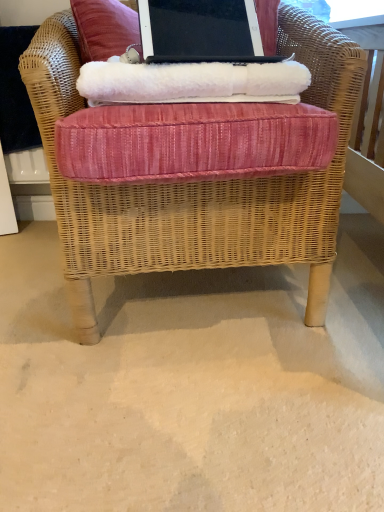
Question: Is white fluffy blanket at upper center far from woven wicker chair at center?

Choices:
 (A) no
 (B) yes

Answer: (A)

Question: From the image's perspective, does white fluffy blanket at upper center appear lower than woven wicker chair at center?

Choices:
 (A) no
 (B) yes

Answer: (A)

Question: Does white fluffy blanket at upper center turn towards woven wicker chair at center?

Choices:
 (A) no
 (B) yes

Answer: (B)

Question: Considering the relative positions of white fluffy blanket at upper center and woven wicker chair at center in the image provided, is white fluffy blanket at upper center to the left of woven wicker chair at center from the viewer's perspective?

Choices:
 (A) yes
 (B) no

Answer: (B)

Question: Does white fluffy blanket at upper center appear on the right side of woven wicker chair at center?

Choices:
 (A) no
 (B) yes

Answer: (B)

Question: Is white fluffy blanket at upper center facing away from woven wicker chair at center?

Choices:
 (A) yes
 (B) no

Answer: (A)

Question: From a real-world perspective, is woven wicker chair at center under white fluffy blanket at upper center?

Choices:
 (A) yes
 (B) no

Answer: (A)

Question: Can you confirm if woven wicker chair at center is shorter than white fluffy blanket at upper center?

Choices:
 (A) yes
 (B) no

Answer: (B)

Question: Does woven wicker chair at center have a lesser width compared to white fluffy blanket at upper center?

Choices:
 (A) yes
 (B) no

Answer: (B)

Question: Is woven wicker chair at center positioned beyond the bounds of white fluffy blanket at upper center?

Choices:
 (A) no
 (B) yes

Answer: (B)

Question: Can you confirm if woven wicker chair at center is positioned to the right of white fluffy blanket at upper center?

Choices:
 (A) yes
 (B) no

Answer: (B)

Question: Is woven wicker chair at center positioned far away from white fluffy blanket at upper center?

Choices:
 (A) yes
 (B) no

Answer: (B)

Question: Does woven wicker chair at center have a lesser width compared to black matte laptop at upper center?

Choices:
 (A) no
 (B) yes

Answer: (A)